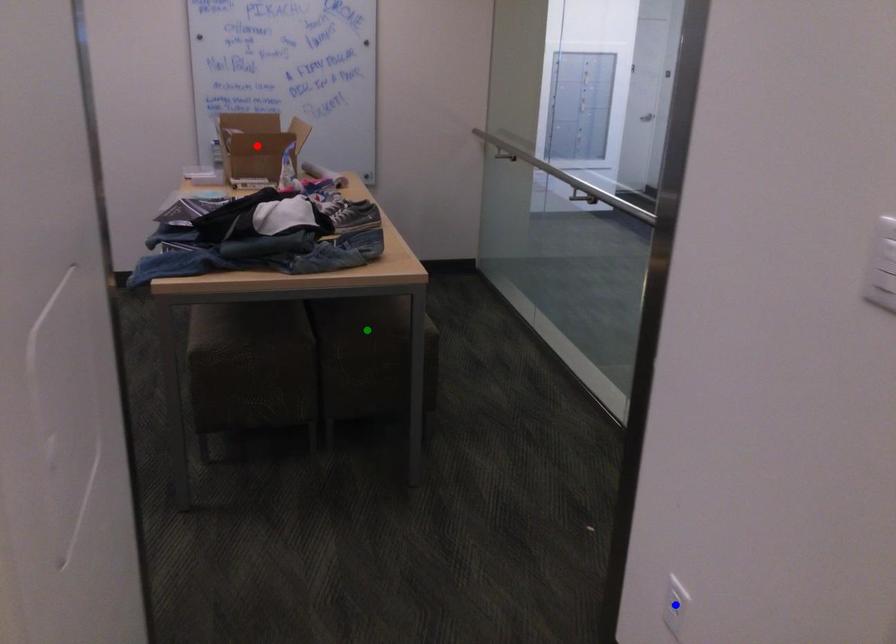
Order these from nearest to farthest:
green point | blue point | red point

1. blue point
2. green point
3. red point